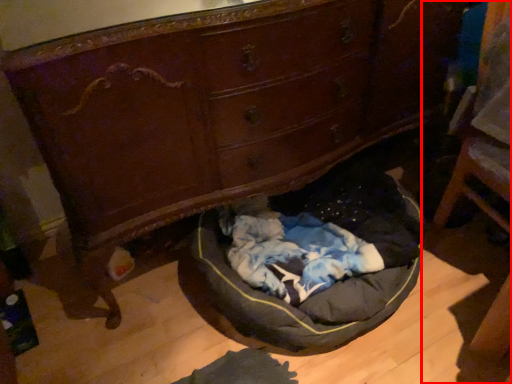
Question: From the image's perspective, what is the correct spatial positioning of furniture (annotated by the red box) in reference to dog bed?

Choices:
 (A) above
 (B) below

Answer: (A)